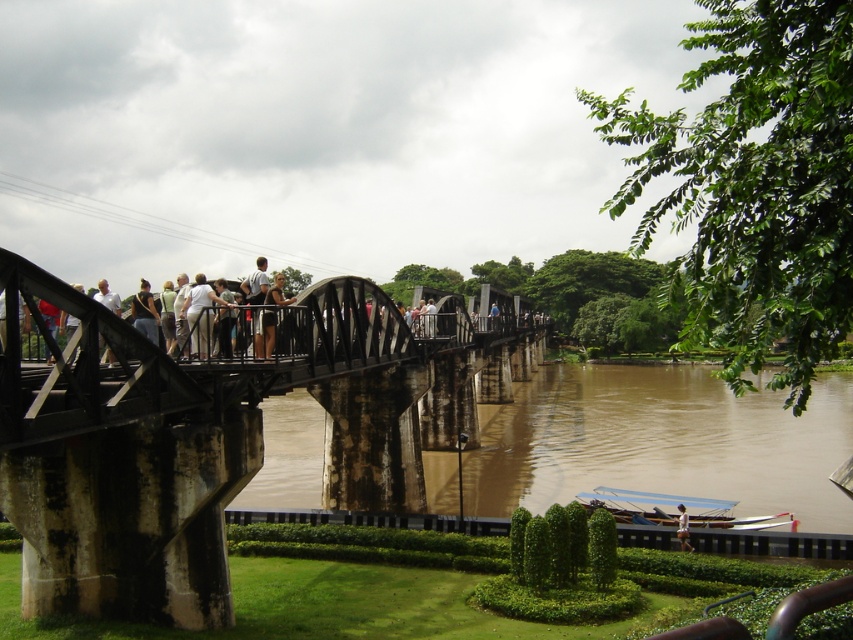
Question: Which of the following is the closest to the observer?

Choices:
 (A) (151, 321)
 (B) (251, 305)

Answer: (A)

Question: Can you confirm if light brown wooden railing at center is positioned to the left of white fabric shirt at upper center?

Choices:
 (A) no
 (B) yes

Answer: (B)

Question: Which object is closer to the camera taking this photo?

Choices:
 (A) brown muddy water at lower center
 (B) light brown wooden bridge at center
 (C) rusty metal bridge at center
 (D) matte black jacket at center

Answer: (C)

Question: Can you confirm if rusty metal bridge at center is positioned above light brown wooden bridge at center?

Choices:
 (A) yes
 (B) no

Answer: (B)

Question: Which object is closer to the camera taking this photo?

Choices:
 (A) matte black shirt at center
 (B) brown muddy water at lower center
 (C) light brown wooden railing at center
 (D) blue plastic boat at lower right

Answer: (C)

Question: Can you confirm if brown muddy water at lower center is bigger than light brown wooden pole at center?

Choices:
 (A) no
 (B) yes

Answer: (B)